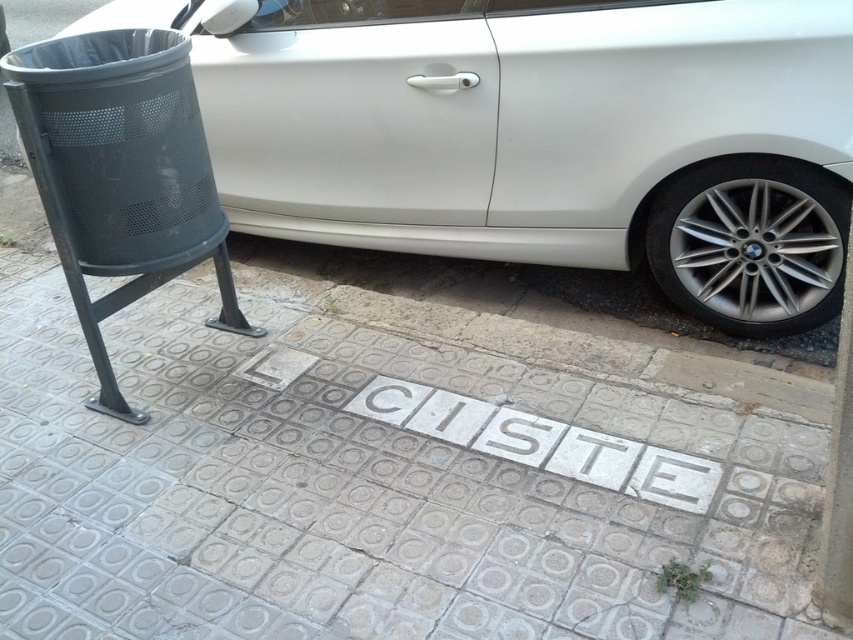
You are standing on the sidewalk and want to walk from the trash bin to the BMW. Which point, point (759, 490) or point (662, 180), is closer to you as you start walking?

Point (759, 490) is closer to the viewer than point (662, 180), so you should head towards point (759, 490) first.

You are a delivery robot with a width of 24 inches. You need to move from the white tile pavement at lower center to the silver metallic wheel at lower right. Can you fit through the space between them?

The distance between the white tile pavement at lower center and the silver metallic wheel at lower right is 23.41 inches. Since the robot is 24 inches wide, it cannot fit through the space between them.

You are a delivery person trying to park your bike between the white tile pavement at lower center and the sleek white car at center. Can you fit your bike there if the bike is 1.2 meters wide?

The white tile pavement at lower center is shorter than the sleek white car at center. However, the description does not provide the exact width of the space between them. Without knowing the available space, it is impossible to determine if the bike will fit.